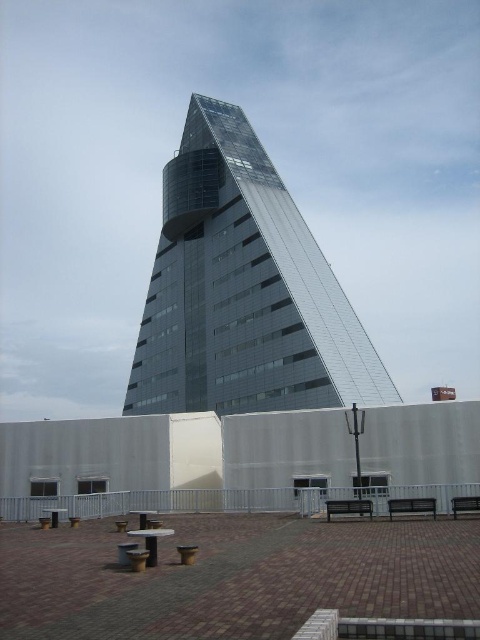
You are standing at the entrance of the modern architectural structure and want to sit on the black metal bench at lower right. Which direction should you walk to reach it?

The black metal bench at lower right is located at point [411,506], so you should walk towards the lower right direction to reach it.

You are a visitor at the modern architectural structure and want to sit on one of the benches. If you are standing at the center of the paved area, which bench is closer to you, the black metal bench at lower right or the metallic silver bench at lower right?

Both the black metal bench at lower right and the metallic silver bench at lower right are located at the same position, so they are equally close to you.

You are sitting on the wooden park bench at center and want to move to the metallic silver bench at lower right. Which direction should you walk to reach it?

You should walk backward because the wooden park bench at center is in front of the metallic silver bench at lower right, meaning the silver bench is behind you relative to your current position.